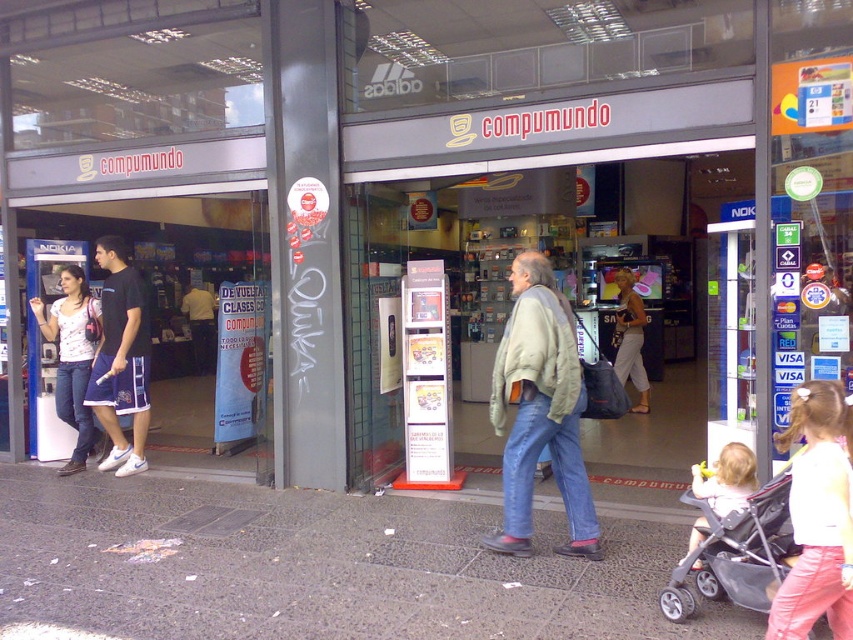
How distant is dark gray concrete sidewalk at center from matte beige pants at center?

They are 4.98 meters apart.

Where is `dark gray concrete sidewalk at center`? This screenshot has height=640, width=853. dark gray concrete sidewalk at center is located at coordinates (318, 566).

The height and width of the screenshot is (640, 853). Find the location of `dark gray concrete sidewalk at center`. dark gray concrete sidewalk at center is located at coordinates (318, 566).

Who is positioned more to the right, light gray woolen jacket at center or yellow shirt at center?

Positioned to the right is light gray woolen jacket at center.

Consider the image. Measure the distance between light gray woolen jacket at center and yellow shirt at center.

light gray woolen jacket at center and yellow shirt at center are 9.92 meters apart from each other.

Is point (535, 433) farther from camera compared to point (202, 358)?

No, (535, 433) is in front of (202, 358).

Where is `light gray woolen jacket at center`? This screenshot has width=853, height=640. light gray woolen jacket at center is located at coordinates point(540,410).

Who is more forward, (300, 557) or (213, 330)?

Point (300, 557) is in front.

Does dark gray concrete sidewalk at center appear under yellow shirt at center?

Yes.

You are a GUI agent. You are given a task and a screenshot of the screen. Output one action in this format:
    pyautogui.click(x=<x>, y=<y>)
    Task: Click on the dark gray concrete sidewalk at center
    
    Given the screenshot: What is the action you would take?
    pyautogui.click(x=318, y=566)

Find the location of a particular element. dark gray concrete sidewalk at center is located at coordinates (318, 566).